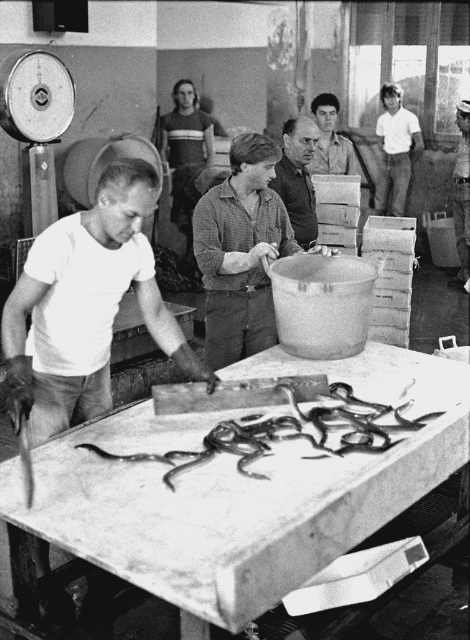
Based on the scene description, where is the matte brown shirt at center located in terms of coordinates?

The matte brown shirt at center is located at coordinates point (241, 252).